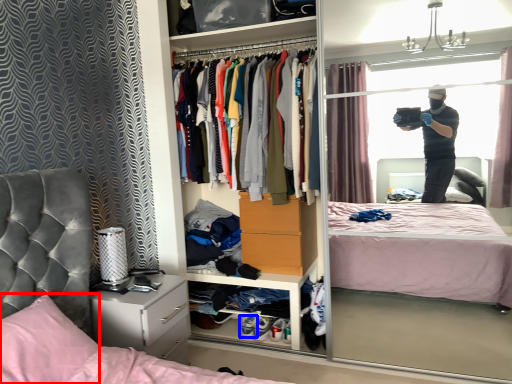
Question: Which of the following is the closest to the observer, pillow (highlighted by a red box) or footwear (highlighted by a blue box)?

Choices:
 (A) pillow
 (B) footwear

Answer: (A)